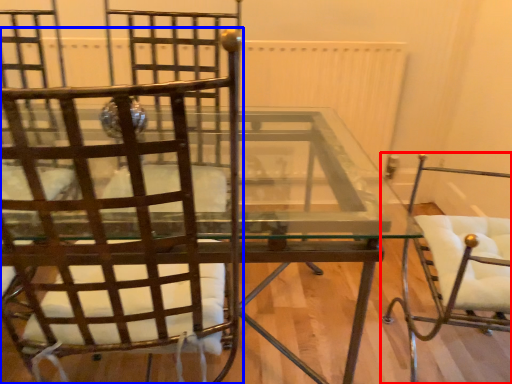
Question: Which point is further to the camera, chair (highlighted by a red box) or chair (highlighted by a blue box)?

Choices:
 (A) chair
 (B) chair

Answer: (A)